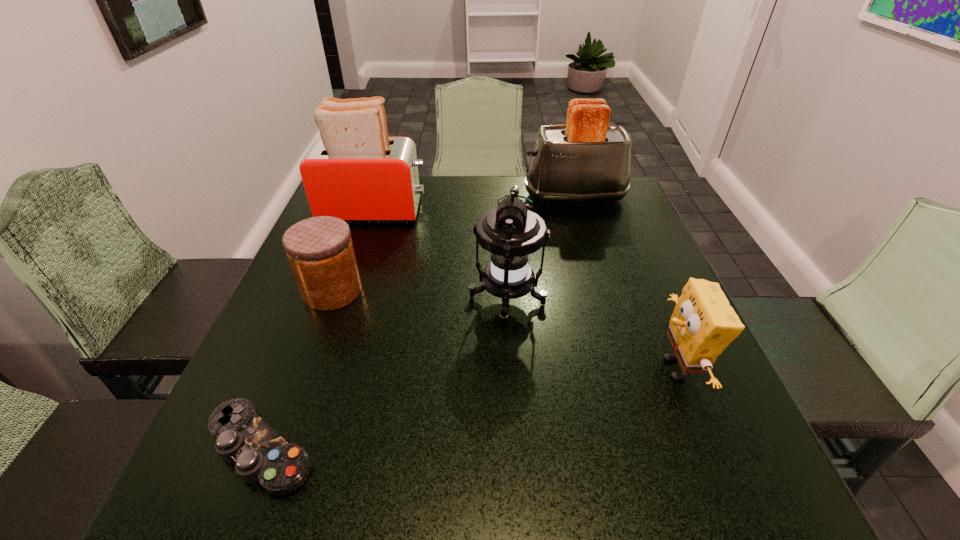
This screenshot has width=960, height=540. Find the location of `the left toaster`. the left toaster is located at coordinates (x=354, y=171).

This screenshot has width=960, height=540. What are the coordinates of `the right toaster` in the screenshot? It's located at pos(585,160).

Identify the location of lantern. Image resolution: width=960 pixels, height=540 pixels. (510, 233).

Where is `sponge`? The width and height of the screenshot is (960, 540). sponge is located at coordinates (703, 324).

Where is `jar`? The width and height of the screenshot is (960, 540). jar is located at coordinates (320, 251).

At what (x,y) coordinates should I click in order to perform the action: click on the shortest object. Please return your answer as a coordinate pair (x, y). The height and width of the screenshot is (540, 960). Looking at the image, I should click on (261, 455).

You are a GUI agent. You are given a task and a screenshot of the screen. Output one action in this format:
    pyautogui.click(x=<x>, y=<y>)
    Task: Click on the vacant position located 0.290m on the front-facing side of the left toaster
    The height and width of the screenshot is (540, 960).
    Given the screenshot: What is the action you would take?
    pyautogui.click(x=534, y=211)

Locate an element on the screen. vacant region located 0.270m on the side of the right toaster with the control lever is located at coordinates (428, 197).

Identify the location of free spot located on the side of the right toaster with the control lever. The width and height of the screenshot is (960, 540). (452, 197).

Identify the location of vacant space situated 0.370m on the side of the right toaster with the control lever. (393, 197).